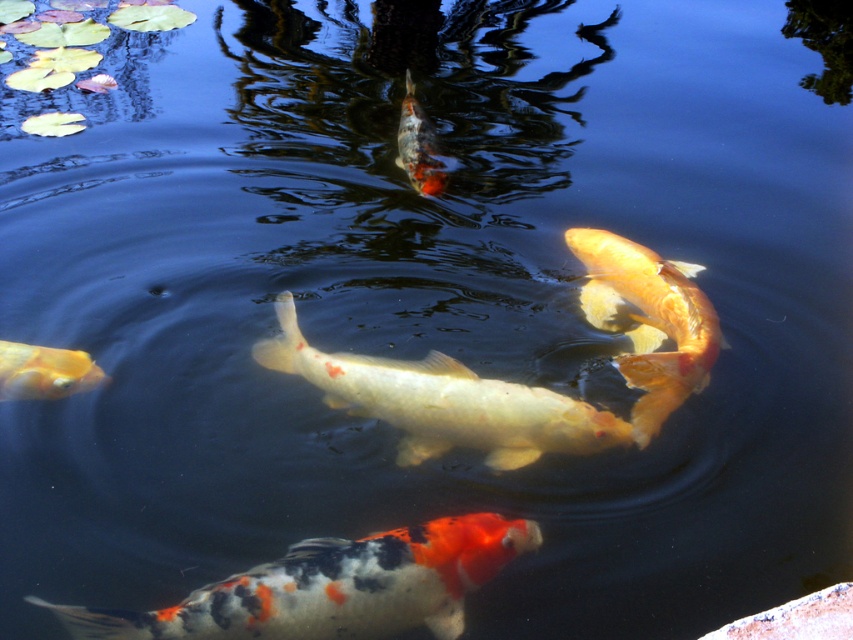
Question: Estimate the real-world distances between objects in this image. Which object is farther from the shiny orange fish at center?

Choices:
 (A) shiny gold fish at center
 (B) speckled orange and white fish at center
 (C) orange and white speckled goldfish at upper center

Answer: (C)

Question: Among these points, which one is farthest from the camera?

Choices:
 (A) (326, 371)
 (B) (438, 188)
 (C) (376, 589)
 (D) (7, 369)

Answer: (B)

Question: Does shiny orange fish at center come behind orange and white speckled goldfish at upper center?

Choices:
 (A) no
 (B) yes

Answer: (A)

Question: Is speckled orange and white fish at center thinner than shiny gold fish at left?

Choices:
 (A) no
 (B) yes

Answer: (A)

Question: Does speckled orange and white fish at center have a larger size compared to shiny gold fish at center?

Choices:
 (A) no
 (B) yes

Answer: (A)

Question: Considering the real-world distances, which object is farthest from the shiny gold fish at left?

Choices:
 (A) shiny gold fish at center
 (B) orange and white speckled goldfish at upper center

Answer: (B)